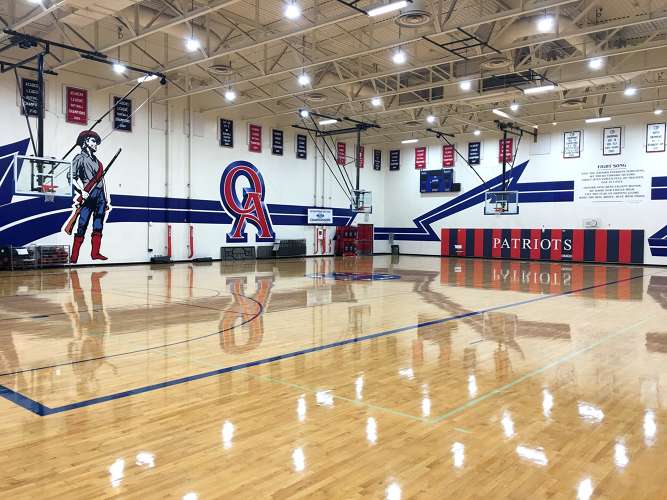
This screenshot has width=667, height=500. I want to click on reflection of overhead light, so 514,431.